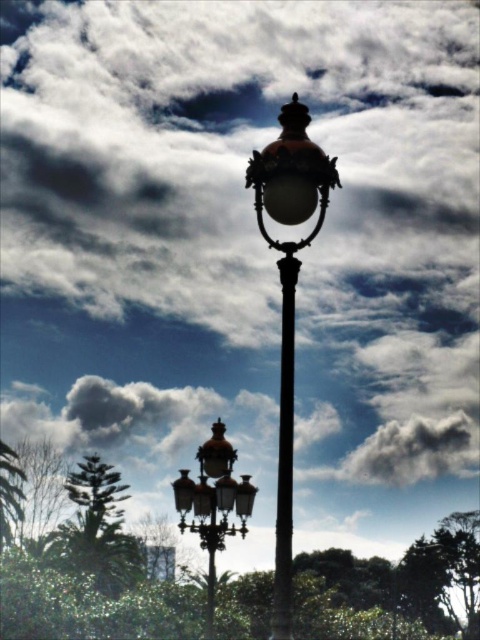
Based on the photo, which is more to the left, green leafy tree at lower left or polished brass street light at center?

From the viewer's perspective, green leafy tree at lower left appears more on the left side.

Can you confirm if green leafy tree at lower left is shorter than polished brass street light at center?

Yes.

Does point (96, 532) lie in front of point (230, 465)?

No, it is not.

Identify the location of green leafy tree at lower left. The width and height of the screenshot is (480, 640). (96, 529).

Measure the distance between green leafy tree at lower left and black polished pole at center.

A distance of 57.59 meters exists between green leafy tree at lower left and black polished pole at center.

Does green leafy tree at lower left have a greater width compared to black polished pole at center?

Indeed, green leafy tree at lower left has a greater width compared to black polished pole at center.

Does point (111, 579) come farther from viewer compared to point (276, 605)?

Yes, it is.

You are a GUI agent. You are given a task and a screenshot of the screen. Output one action in this format:
    pyautogui.click(x=<x>, y=<y>)
    Task: Click on the green leafy tree at lower left
    The image size is (480, 640).
    Given the screenshot: What is the action you would take?
    pyautogui.click(x=96, y=529)

Can you confirm if green leafy tree at lower left is shorter than glossy brass streetlight at upper center?

No, green leafy tree at lower left is not shorter than glossy brass streetlight at upper center.

Is point (88, 548) positioned in front of point (303, 134)?

No, (88, 548) is behind (303, 134).

The width and height of the screenshot is (480, 640). Describe the element at coordinates (96, 529) in the screenshot. I see `green leafy tree at lower left` at that location.

Locate an element on the screen. The image size is (480, 640). green leafy tree at lower left is located at coordinates (96, 529).